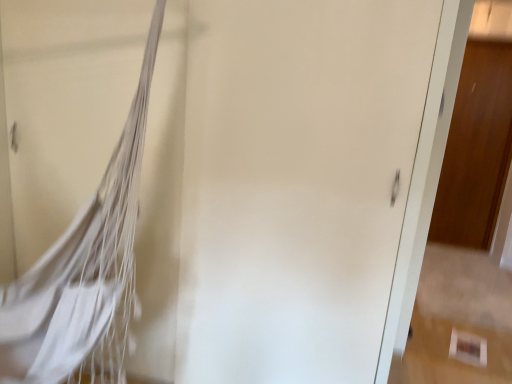
Question: Is white fabric hammock at left completely or partially inside wooden door at right?

Choices:
 (A) no
 (B) yes

Answer: (A)

Question: Considering the relative positions of wooden door at right and white fabric hammock at left in the image provided, is wooden door at right behind white fabric hammock at left?

Choices:
 (A) no
 (B) yes

Answer: (B)

Question: Is wooden door at right smaller than white fabric hammock at left?

Choices:
 (A) no
 (B) yes

Answer: (B)

Question: Could you tell me if wooden door at right is facing white fabric hammock at left?

Choices:
 (A) yes
 (B) no

Answer: (B)

Question: Is wooden door at right not close to white fabric hammock at left?

Choices:
 (A) yes
 (B) no

Answer: (A)

Question: From a real-world perspective, is wooden door at right positioned over white fabric hammock at left based on gravity?

Choices:
 (A) no
 (B) yes

Answer: (B)

Question: Is white fabric hammock at left not close to wooden door at right?

Choices:
 (A) no
 (B) yes

Answer: (B)

Question: From a real-world perspective, is white fabric hammock at left positioned over wooden door at right based on gravity?

Choices:
 (A) no
 (B) yes

Answer: (A)

Question: Is white fabric hammock at left at the left side of wooden door at right?

Choices:
 (A) yes
 (B) no

Answer: (A)

Question: From the image's perspective, is white fabric hammock at left under wooden door at right?

Choices:
 (A) yes
 (B) no

Answer: (A)

Question: Could you tell me if white fabric hammock at left is facing wooden door at right?

Choices:
 (A) yes
 (B) no

Answer: (B)

Question: Is white fabric hammock at left turned away from wooden door at right?

Choices:
 (A) yes
 (B) no

Answer: (B)

Question: Do you think white fabric hammock at left is within wooden door at right, or outside of it?

Choices:
 (A) inside
 (B) outside

Answer: (B)